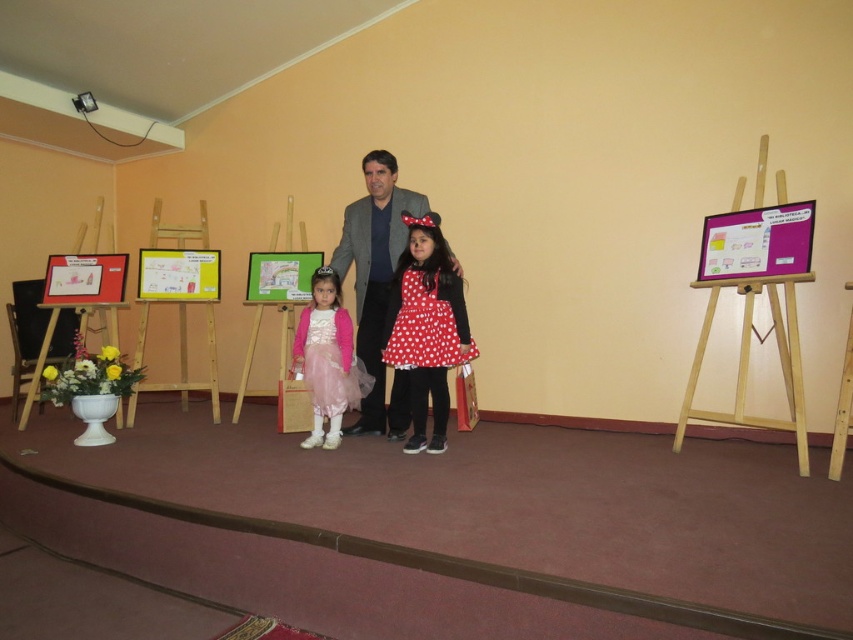
Is gray woolen suit at center positioned at the back of wooden easel at left?

No.

Is gray woolen suit at center shorter than wooden easel at left?

Incorrect, gray woolen suit at center's height does not fall short of wooden easel at left's.

Measure the distance between point (352, 428) and camera.

Point (352, 428) and camera are 13.41 feet apart from each other.

In order to click on gray woolen suit at center in this screenshot , I will do `click(376, 285)`.

Which is more to the left, wooden easel at right or polka dot fabric dress at center?

polka dot fabric dress at center is more to the left.

Does wooden easel at right have a greater height compared to polka dot fabric dress at center?

Correct, wooden easel at right is much taller as polka dot fabric dress at center.

Who is more distant from viewer, (788, 376) or (404, 307)?

The point (404, 307) is more distant.

Identify the location of wooden easel at right. (753, 296).

Is point (368, 166) farther from camera compared to point (318, 392)?

Yes, point (368, 166) is farther from viewer.

Between gray woolen suit at center and pastel pink tulle dress at center, which one appears on the right side from the viewer's perspective?

gray woolen suit at center

Is point (370, 429) behind point (309, 381)?

Yes, point (370, 429) is behind point (309, 381).

This screenshot has height=640, width=853. In order to click on gray woolen suit at center in this screenshot , I will do `click(376, 285)`.